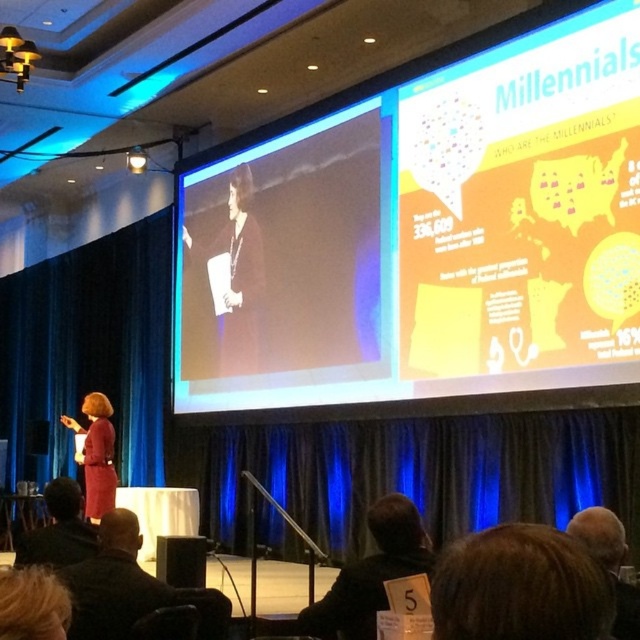
In order to click on brown hair at upper center in this screenshot , I will do `click(520, 586)`.

Is brown hair at upper center taller than matte red dress at center?

In fact, brown hair at upper center may be shorter than matte red dress at center.

Describe the element at coordinates (520, 586) in the screenshot. I see `brown hair at upper center` at that location.

Locate an element on the screen. brown hair at upper center is located at coordinates (520, 586).

Between matte black screen at upper center and matte black dress at center, which one is positioned higher?

matte black screen at upper center

Does point (550, 100) lie behind point (228, 230)?

No, it is in front of (228, 230).

Looking at this image, who is more forward, (492, 269) or (220, 340)?

Point (492, 269)

I want to click on matte black screen at upper center, so click(426, 236).

Who is higher up, matte black screen at upper center or dark brown leather jacket at lower center?

matte black screen at upper center is above.

Between matte black screen at upper center and dark brown leather jacket at lower center, which one has less height?

dark brown leather jacket at lower center is shorter.

What are the coordinates of `matte black screen at upper center` in the screenshot? It's located at (426, 236).

Identify the location of matte black screen at upper center. The image size is (640, 640). (426, 236).